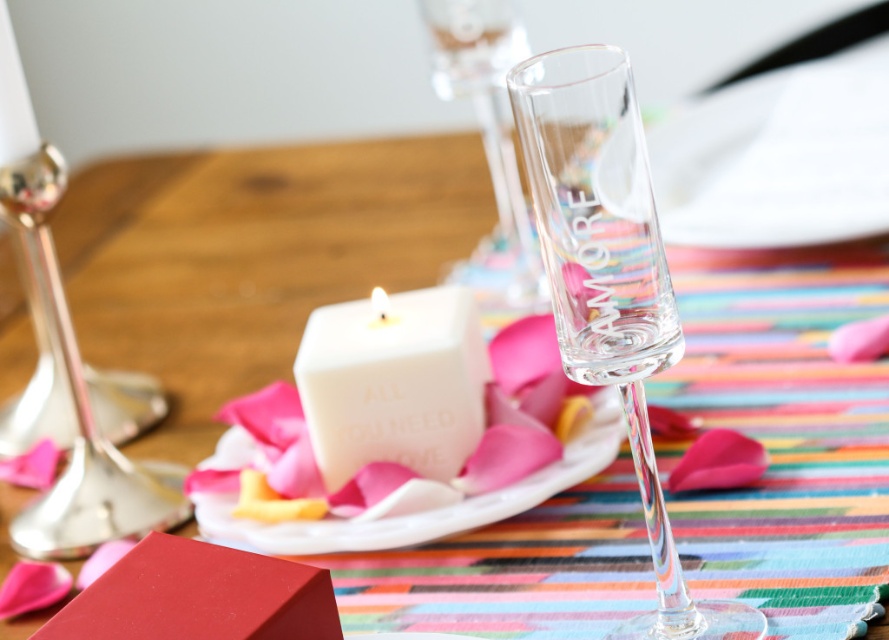
From the picture: You are a guest at a dinner party and want to reach for the transparent glass flute at center without knocking over the white matte cube at center. Which object should you move closer to first?

You should move closer to the transparent glass flute at center first because it is closer to the viewer than the white matte cube at center, so you can safely reach it without disturbing the cube.

Based on the photo, you are a guest at a dinner party and want to reach for the white matte plate at center without moving your chair. Can you do it comfortably?

The white matte plate at center is 14.02 inches away from the viewer, so yes, you can comfortably reach it without moving your chair.

You are setting up a table for a romantic dinner. You have a transparent glass flute at center and a white matte plate at center. Which item is smaller in size?

The transparent glass flute at center is smaller in size compared to the white matte plate at center.